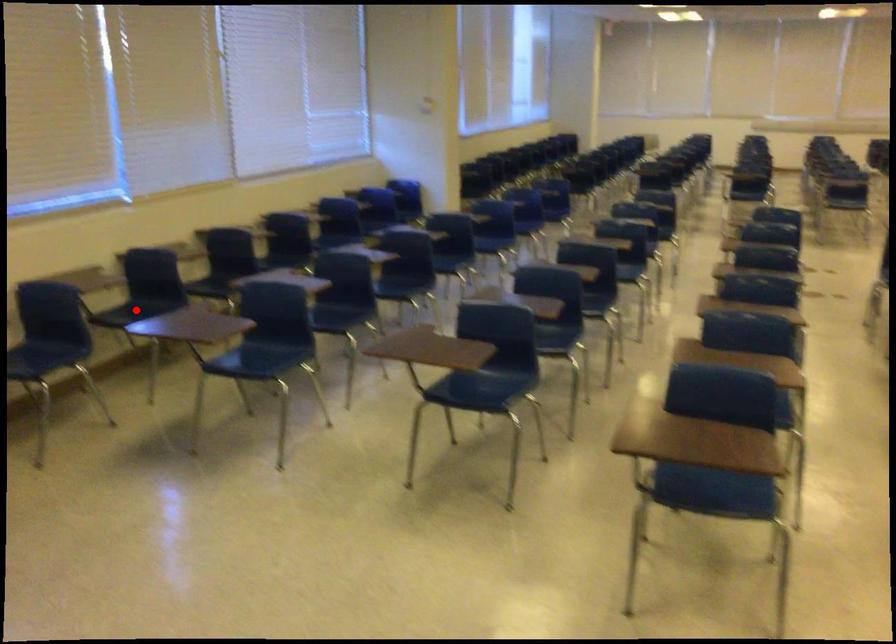
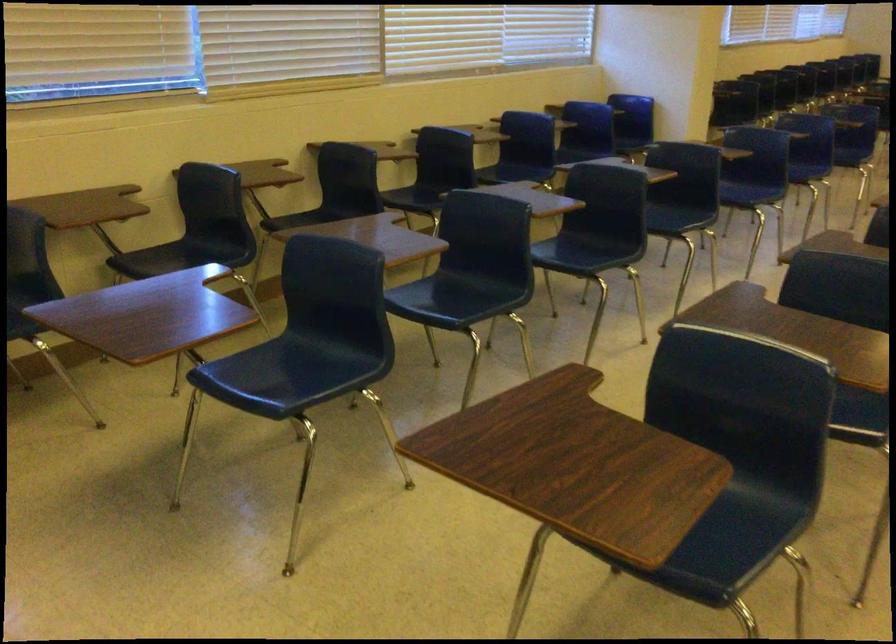
Locate, in the second image, the point that corresponds to the highlighted location in the first image.

(181, 257)